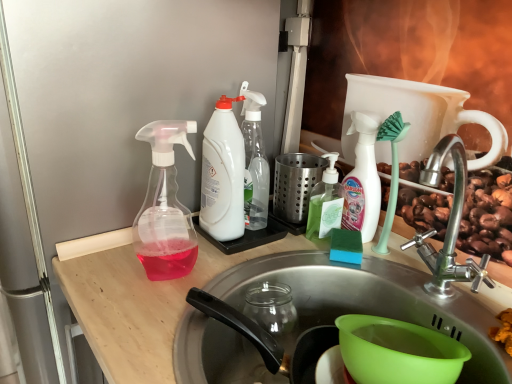
This screenshot has height=384, width=512. Find the location of `free space to the left of green translucent soap dispenser at center, which is the 2th bottle in right-to-left order`. free space to the left of green translucent soap dispenser at center, which is the 2th bottle in right-to-left order is located at coordinates (264, 243).